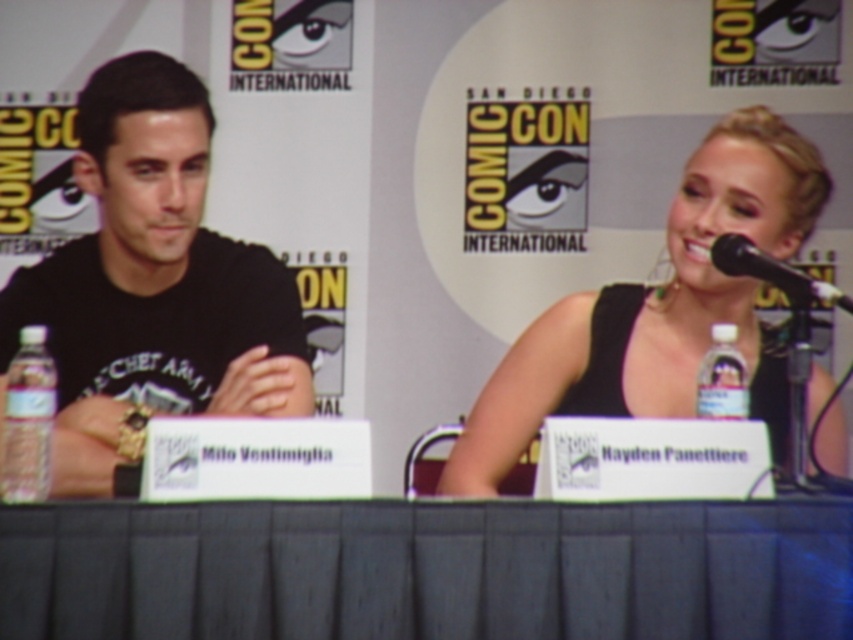
You are attending Comic Con and want to take a photo of the black fabric table at center and the black matte shirt at left. Since both are black, how can you tell which one is closer to you?

The black fabric table at center is closer to the viewer than the black matte shirt at left, so you can identify the closer object by its proximity in the image.

You are a photographer at Comic Con trying to focus your camera on two points in the scene. The first point is at coordinates point (15, 387) and the second is at point (756, 257). Which point should you focus on first if you want to capture the closest object to the camera?

You should focus on point (15, 387) first because it is closer to the camera than point (756, 257) according to the description.

You are attending a panel discussion at Comic Con and notice the clear plastic bottle at left and the black plastic microphone at upper right. Which object is positioned lower in the image?

The clear plastic bottle at left is located below the black plastic microphone at upper right, so it is positioned lower in the image.